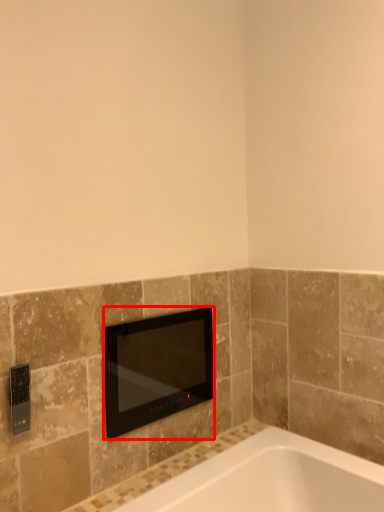
Question: Observing the image, what is the correct spatial positioning of television (annotated by the red box) in reference to light switch?

Choices:
 (A) right
 (B) left

Answer: (A)